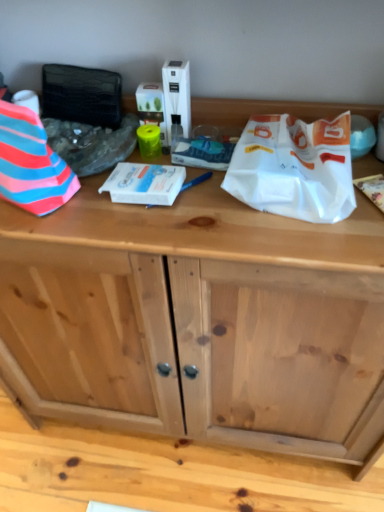
Question: Does white glossy box at center, positioned as the 2th wrapping paper in right-to-left order, turn towards striped fabric at left, arranged as the third wrapping paper when viewed from the right?

Choices:
 (A) yes
 (B) no

Answer: (B)

Question: From the image's perspective, is white glossy box at center, positioned as the 2th wrapping paper in right-to-left order, on top of striped fabric at left, arranged as the third wrapping paper when viewed from the right?

Choices:
 (A) no
 (B) yes

Answer: (A)

Question: Is striped fabric at left, which is the 1th wrapping paper in left-to-right order, a part of white glossy box at center, positioned as the 2th wrapping paper in right-to-left order?

Choices:
 (A) no
 (B) yes

Answer: (A)

Question: Does white glossy box at center, positioned as the 2th wrapping paper in right-to-left order, appear on the left side of striped fabric at left, which is the 1th wrapping paper in left-to-right order?

Choices:
 (A) yes
 (B) no

Answer: (B)

Question: Is white glossy box at center, positioned as the 2th wrapping paper in right-to-left order, in front of striped fabric at left, which is the 1th wrapping paper in left-to-right order?

Choices:
 (A) yes
 (B) no

Answer: (B)

Question: Is striped fabric at left, which is the 1th wrapping paper in left-to-right order, inside or outside of white glossy box at center, the second wrapping paper positioned from the left?

Choices:
 (A) outside
 (B) inside

Answer: (A)

Question: Is striped fabric at left, arranged as the third wrapping paper when viewed from the right, bigger or smaller than white glossy box at center, the second wrapping paper positioned from the left?

Choices:
 (A) small
 (B) big

Answer: (B)

Question: Based on their positions, is striped fabric at left, which is the 1th wrapping paper in left-to-right order, located to the left or right of white glossy box at center, the second wrapping paper positioned from the left?

Choices:
 (A) right
 (B) left

Answer: (B)

Question: Relative to white glossy box at center, positioned as the 2th wrapping paper in right-to-left order, is striped fabric at left, arranged as the third wrapping paper when viewed from the right, in front or behind?

Choices:
 (A) behind
 (B) front

Answer: (B)

Question: From a real-world perspective, is white glossy box at center, the second wrapping paper positioned from the left, above or below white paper bag at upper right, the 3th wrapping paper positioned from the left?

Choices:
 (A) below
 (B) above

Answer: (A)

Question: In the image, is white glossy box at center, positioned as the 2th wrapping paper in right-to-left order, on the left side or the right side of white paper bag at upper right, which appears as the first wrapping paper when viewed from the right?

Choices:
 (A) left
 (B) right

Answer: (A)

Question: Considering the positions of white glossy box at center, positioned as the 2th wrapping paper in right-to-left order, and white paper bag at upper right, the 3th wrapping paper positioned from the left, in the image, is white glossy box at center, positioned as the 2th wrapping paper in right-to-left order, bigger or smaller than white paper bag at upper right, the 3th wrapping paper positioned from the left,?

Choices:
 (A) big
 (B) small

Answer: (B)

Question: Considering the positions of point (125, 175) and point (347, 179), is point (125, 175) closer or farther from the camera than point (347, 179)?

Choices:
 (A) closer
 (B) farther

Answer: (B)

Question: From the image's perspective, relative to white paper bag at upper right, which appears as the first wrapping paper when viewed from the right, is striped fabric at left, arranged as the third wrapping paper when viewed from the right, above or below?

Choices:
 (A) below
 (B) above

Answer: (B)

Question: Considering the positions of striped fabric at left, arranged as the third wrapping paper when viewed from the right, and white paper bag at upper right, which appears as the first wrapping paper when viewed from the right, in the image, is striped fabric at left, arranged as the third wrapping paper when viewed from the right, wider or thinner than white paper bag at upper right, which appears as the first wrapping paper when viewed from the right,?

Choices:
 (A) wide
 (B) thin

Answer: (B)